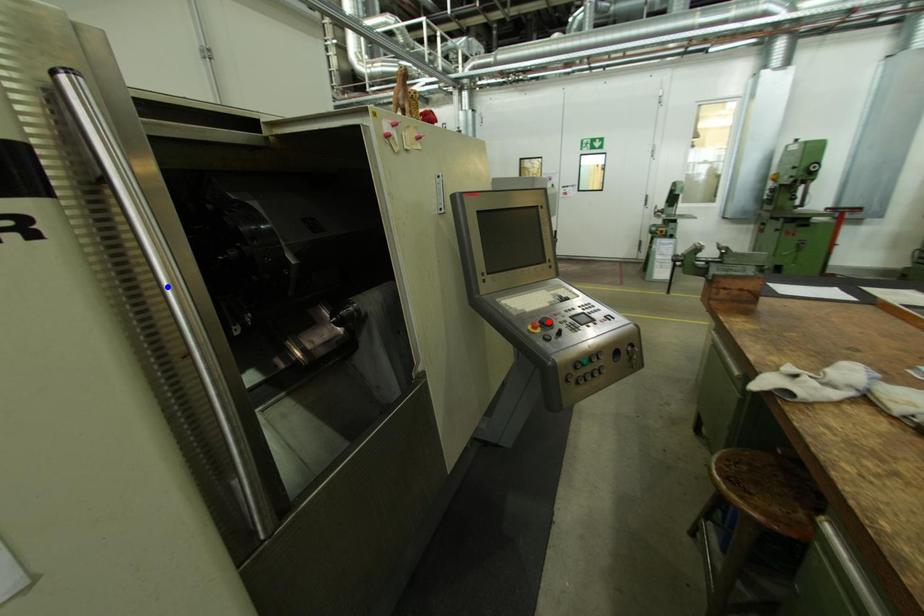
Question: In the image, two points are highlighted. Which point is nearer to the camera? Reply with the corresponding letter.

Choices:
 (A) blue point
 (B) red point

Answer: (A)